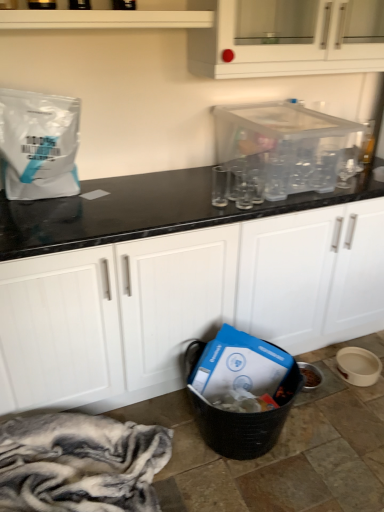
What is the approximate width of white glossy shelf at upper center?

26.81 centimeters.

Image resolution: width=384 pixels, height=512 pixels. I want to click on white glossy cabinet at upper center, which ranks as the second cabinetry in bottom-to-top order, so click(x=281, y=48).

The width and height of the screenshot is (384, 512). Describe the element at coordinates (281, 48) in the screenshot. I see `white glossy cabinet at upper center, which appears as the 1th cabinetry when viewed from the top` at that location.

This screenshot has height=512, width=384. What do you see at coordinates (289, 146) in the screenshot?
I see `transparent plastic container at upper center` at bounding box center [289, 146].

I want to click on white matte cabinet at center, which is the 2th cabinetry in top-to-bottom order, so click(x=183, y=302).

Which of these two, transparent plastic container at upper center or white glossy cabinet at upper center, which ranks as the second cabinetry in bottom-to-top order, is wider?

transparent plastic container at upper center is wider.

Is there a large distance between transparent plastic container at upper center and white glossy cabinet at upper center, which ranks as the second cabinetry in bottom-to-top order?

No.

Is white glossy cabinet at upper center, which appears as the 1th cabinetry when viewed from the top, located within transparent plastic container at upper center?

No, white glossy cabinet at upper center, which appears as the 1th cabinetry when viewed from the top, is not surrounded by transparent plastic container at upper center.

Locate an element on the screen. This screenshot has width=384, height=512. cabinetry located above the transparent plastic container at upper center (from a real-world perspective) is located at coordinates (281, 48).

In the scene shown: Is white matte paper bag at upper left positioned behind white matte cabinet at center, which is the 2th cabinetry in top-to-bottom order?

Yes, white matte paper bag at upper left is behind white matte cabinet at center, which is the 2th cabinetry in top-to-bottom order.

Consider the image. Which is more distant, (22,183) or (102,375)?

The point (102,375) is more distant.

Can you confirm if white matte paper bag at upper left is positioned to the left of white matte cabinet at center, the 1th cabinetry when ordered from bottom to top?

Yes.

Based on the photo, how different are the orientations of white matte paper bag at upper left and white matte cabinet at center, the 1th cabinetry when ordered from bottom to top, in degrees?

2.34 degrees separate the facing orientations of white matte paper bag at upper left and white matte cabinet at center, the 1th cabinetry when ordered from bottom to top.

Starting from the white glossy shelf at upper center, which cabinetry is the 2nd one to the right? Please provide its 2D coordinates.

[(281, 48)]

Could you tell me if white glossy shelf at upper center is facing white glossy cabinet at upper center, which ranks as the second cabinetry in bottom-to-top order?

No, white glossy shelf at upper center is not turned towards white glossy cabinet at upper center, which ranks as the second cabinetry in bottom-to-top order.

Would you consider white glossy shelf at upper center to be distant from white glossy cabinet at upper center, which ranks as the second cabinetry in bottom-to-top order?

No, white glossy shelf at upper center is not far away from white glossy cabinet at upper center, which ranks as the second cabinetry in bottom-to-top order.

Is transparent plastic container at upper center with white glossy shelf at upper center?

No.

Relative to white glossy shelf at upper center, is transparent plastic container at upper center in front or behind?

Visually, transparent plastic container at upper center is located behind white glossy shelf at upper center.

Considering the sizes of objects transparent plastic container at upper center and white glossy shelf at upper center in the image provided, who is wider, transparent plastic container at upper center or white glossy shelf at upper center?

transparent plastic container at upper center.

Which object is positioned more to the left, transparent plastic container at upper center or white glossy shelf at upper center?

Positioned to the left is white glossy shelf at upper center.

Can we say white matte cabinet at center, the 1th cabinetry when ordered from bottom to top, lies outside white matte paper bag at upper left?

white matte cabinet at center, the 1th cabinetry when ordered from bottom to top, lies outside white matte paper bag at upper left's area.

What's the angular difference between white matte cabinet at center, which is the 2th cabinetry in top-to-bottom order, and white matte paper bag at upper left's facing directions?

white matte cabinet at center, which is the 2th cabinetry in top-to-bottom order, and white matte paper bag at upper left are facing 2.34 degrees away from each other.

Does white matte cabinet at center, the 1th cabinetry when ordered from bottom to top, have a larger size compared to white matte paper bag at upper left?

Yes.

Which of these two, white matte cabinet at center, which is the 2th cabinetry in top-to-bottom order, or white matte paper bag at upper left, stands shorter?

white matte paper bag at upper left is shorter.

Which object is closer to the camera, white matte paper bag at upper left or transparent plastic container at upper center?

Positioned in front is white matte paper bag at upper left.

From the image's perspective, is white matte paper bag at upper left on transparent plastic container at upper center?

No, from the image's perspective, white matte paper bag at upper left is not on top of transparent plastic container at upper center.

The image size is (384, 512). In order to click on appliance beneath the white matte paper bag at upper left (from a real-world perspective) in this screenshot , I will do click(289, 146).

Consider the image. Is white matte cabinet at center, the 1th cabinetry when ordered from bottom to top, in contact with white glossy cabinet at upper center, which ranks as the second cabinetry in bottom-to-top order?

No, white matte cabinet at center, the 1th cabinetry when ordered from bottom to top, is not with white glossy cabinet at upper center, which ranks as the second cabinetry in bottom-to-top order.

Which object is closer to the camera taking this photo, white matte cabinet at center, which is the 2th cabinetry in top-to-bottom order, or white glossy cabinet at upper center, which ranks as the second cabinetry in bottom-to-top order?

white matte cabinet at center, which is the 2th cabinetry in top-to-bottom order, is closer to the camera.

From the image's perspective, would you say white matte cabinet at center, the 1th cabinetry when ordered from bottom to top, is positioned over white glossy cabinet at upper center, which ranks as the second cabinetry in bottom-to-top order?

Incorrect, from the image's perspective, white matte cabinet at center, the 1th cabinetry when ordered from bottom to top, is lower than white glossy cabinet at upper center, which ranks as the second cabinetry in bottom-to-top order.

Which object is thinner, white matte cabinet at center, which is the 2th cabinetry in top-to-bottom order, or white glossy cabinet at upper center, which ranks as the second cabinetry in bottom-to-top order?

white glossy cabinet at upper center, which ranks as the second cabinetry in bottom-to-top order, is thinner.

Find the location of `appliance below the white glossy cabinet at upper center, which ranks as the second cabinetry in bottom-to-top order (from a real-world perspective)`. appliance below the white glossy cabinet at upper center, which ranks as the second cabinetry in bottom-to-top order (from a real-world perspective) is located at coordinates (289, 146).

What are the coordinates of `cabinetry below the white matte paper bag at upper left (from the image's perspective)` in the screenshot? It's located at (183, 302).

Based on their spatial positions, is white glossy cabinet at upper center, which ranks as the second cabinetry in bottom-to-top order, or transparent plastic container at upper center closer to white matte cabinet at center, the 1th cabinetry when ordered from bottom to top?

Based on the image, transparent plastic container at upper center appears to be nearer to white matte cabinet at center, the 1th cabinetry when ordered from bottom to top.

When comparing their distances from white matte cabinet at center, the 1th cabinetry when ordered from bottom to top, does transparent plastic container at upper center or white glossy cabinet at upper center, which ranks as the second cabinetry in bottom-to-top order, seem further?

white glossy cabinet at upper center, which ranks as the second cabinetry in bottom-to-top order, lies further to white matte cabinet at center, the 1th cabinetry when ordered from bottom to top, than the other object.

From the image, which object appears to be nearer to white matte cabinet at center, which is the 2th cabinetry in top-to-bottom order, white glossy shelf at upper center or transparent plastic container at upper center?

transparent plastic container at upper center is positioned closer to the anchor white matte cabinet at center, which is the 2th cabinetry in top-to-bottom order.

From the image, which object appears to be farther from white glossy shelf at upper center, white matte cabinet at center, the 1th cabinetry when ordered from bottom to top, or transparent plastic container at upper center?

Among the two, white matte cabinet at center, the 1th cabinetry when ordered from bottom to top, is located further to white glossy shelf at upper center.

Looking at the image, which one is located further to transparent plastic container at upper center, white glossy shelf at upper center or white matte paper bag at upper left?

white matte paper bag at upper left.

Estimate the real-world distances between objects in this image. Which object is further from white glossy cabinet at upper center, which appears as the 1th cabinetry when viewed from the top, white glossy shelf at upper center or white matte paper bag at upper left?

The object further to white glossy cabinet at upper center, which appears as the 1th cabinetry when viewed from the top, is white matte paper bag at upper left.

Which object lies nearer to the anchor point white glossy cabinet at upper center, which ranks as the second cabinetry in bottom-to-top order, transparent plastic container at upper center or white matte paper bag at upper left?

transparent plastic container at upper center is closer to white glossy cabinet at upper center, which ranks as the second cabinetry in bottom-to-top order.

Based on their spatial positions, is white glossy shelf at upper center or white glossy cabinet at upper center, which appears as the 1th cabinetry when viewed from the top, closer to white matte cabinet at center, the 1th cabinetry when ordered from bottom to top?

white glossy cabinet at upper center, which appears as the 1th cabinetry when viewed from the top, is closer to white matte cabinet at center, the 1th cabinetry when ordered from bottom to top.

Find the location of a particular element. This screenshot has height=512, width=384. cabinetry located between white matte paper bag at upper left and white glossy cabinet at upper center, which appears as the 1th cabinetry when viewed from the top, in the left-right direction is located at coordinates (183, 302).

The width and height of the screenshot is (384, 512). What are the coordinates of `appliance between white glossy cabinet at upper center, which ranks as the second cabinetry in bottom-to-top order, and white matte cabinet at center, which is the 2th cabinetry in top-to-bottom order, in the vertical direction` in the screenshot? It's located at (289, 146).

At what (x,y) coordinates should I click in order to perform the action: click on paper bag between white glossy shelf at upper center and white matte cabinet at center, which is the 2th cabinetry in top-to-bottom order, vertically. Please return your answer as a coordinate pair (x, y). Looking at the image, I should click on (39, 144).

At what (x,y) coordinates should I click in order to perform the action: click on appliance between white matte paper bag at upper left and white glossy cabinet at upper center, which ranks as the second cabinetry in bottom-to-top order. Please return your answer as a coordinate pair (x, y). The height and width of the screenshot is (512, 384). Looking at the image, I should click on (289, 146).